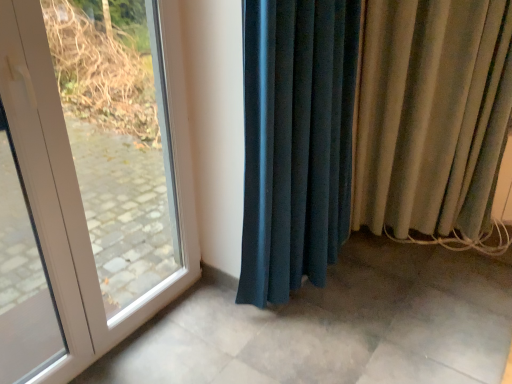
The height and width of the screenshot is (384, 512). Identify the location of free space in front of velvet teal curtain at center, the 2th curtain viewed from the right. (308, 353).